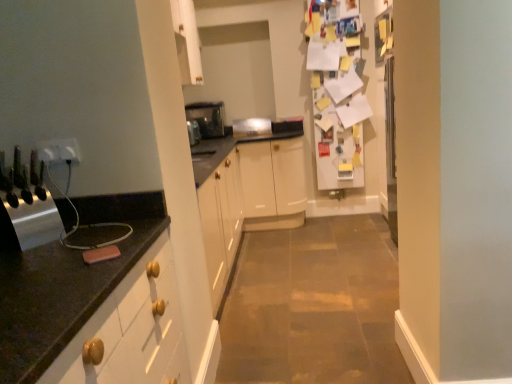
Question: Considering the positions of white paper covered fridge at upper right and white plastic outlet at left, which is the first electric outlet in right-to-left order, in the image, is white paper covered fridge at upper right taller or shorter than white plastic outlet at left, which is the first electric outlet in right-to-left order,?

Choices:
 (A) short
 (B) tall

Answer: (B)

Question: Would you say white paper covered fridge at upper right is to the left or to the right of white plastic outlet at left, which is the first electric outlet in right-to-left order, in the picture?

Choices:
 (A) left
 (B) right

Answer: (B)

Question: Considering the real-world distances, which object is closest to the white plastic electric outlet at left, which is counted as the 2th electric outlet, starting from the right?

Choices:
 (A) satin silver toaster at center, the second appliance in the bottom-to-top sequence
 (B) satin silver toaster at center, the second appliance positioned from the back
 (C) white plastic outlet at left, which is the first electric outlet in right-to-left order
 (D) white paper covered fridge at upper right
 (E) metallic knife block at left, the first appliance in the bottom-to-top sequence

Answer: (C)

Question: Which object is the farthest from the metallic knife block at left, acting as the 4th appliance starting from the top?

Choices:
 (A) satin silver toaster at center, the third appliance from the back
 (B) white paper covered fridge at upper right
 (C) satin silver toaster at center, which is counted as the fourth appliance, starting from the bottom
 (D) white plastic electric outlet at left, which is the 1th electric outlet in left-to-right order
 (E) satin silver toaster at center, acting as the second appliance starting from the top

Answer: (B)